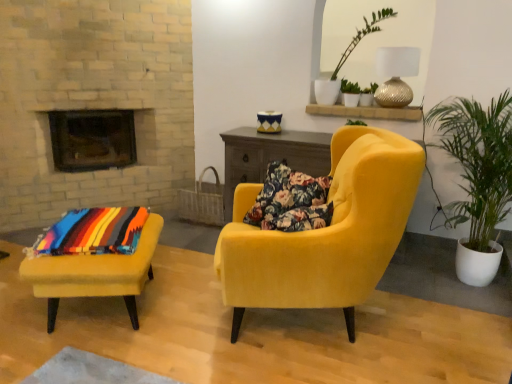
Find the location of `free space in front of green leafy plant in white pot at right`. free space in front of green leafy plant in white pot at right is located at coordinates (457, 337).